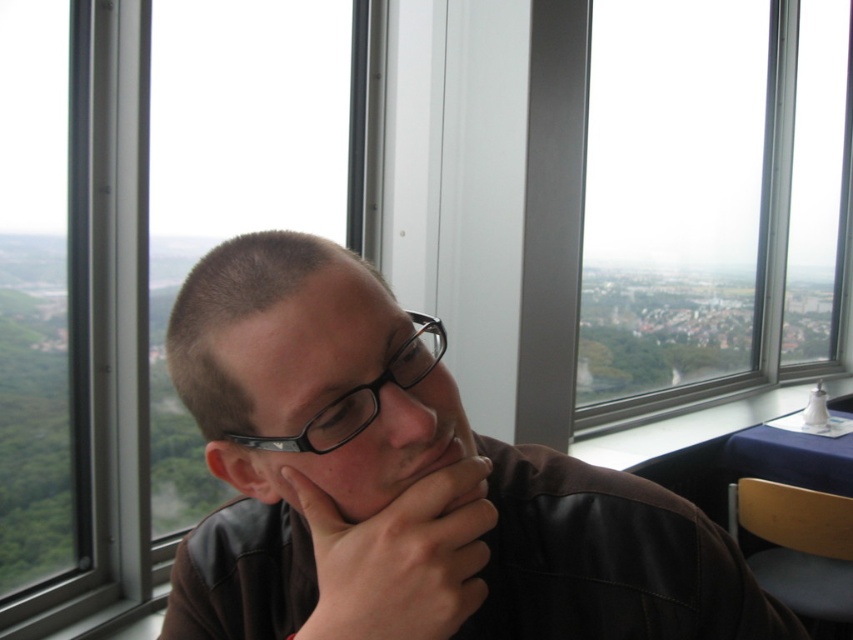
Who is lower down, dark brown leather hand at center or matte black jaw at center?

Positioned lower is dark brown leather hand at center.

Who is more forward, (368,566) or (407,448)?

Point (368,566)

Find the location of a particular element. The height and width of the screenshot is (640, 853). dark brown leather hand at center is located at coordinates (399, 557).

Is point (334, 577) closer to viewer compared to point (439, 326)?

That is True.

Is dark brown leather hand at center positioned before black plastic glasses at center?

Yes.

In order to click on dark brown leather hand at center in this screenshot , I will do `click(399, 557)`.

The image size is (853, 640). I want to click on dark brown leather hand at center, so click(399, 557).

Is matte black jacket at center above matte black jaw at center?

No.

Is point (598, 614) closer to camera compared to point (398, 492)?

No, (598, 614) is behind (398, 492).

The width and height of the screenshot is (853, 640). I want to click on matte black jacket at center, so click(x=407, y=486).